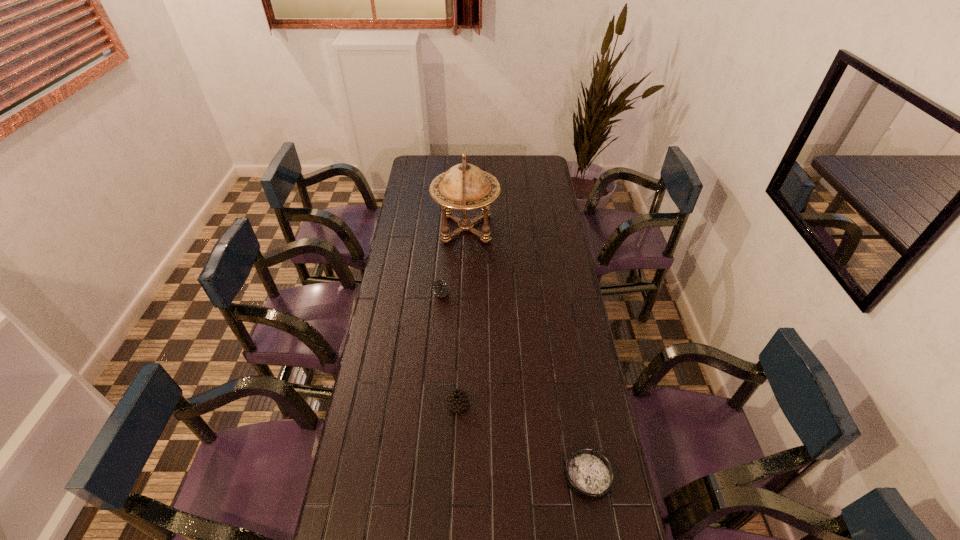
Identify the location of the farthest object. (464, 187).

At what (x,y) coordinates should I click in order to perform the action: click on globe. Please return your answer as a coordinate pair (x, y). This screenshot has width=960, height=540. Looking at the image, I should click on 464,187.

Identify the location of the second farthest object. Image resolution: width=960 pixels, height=540 pixels. (440, 286).

At what (x,y) coordinates should I click in order to perform the action: click on the left pinecone. Please return your answer as a coordinate pair (x, y). This screenshot has width=960, height=540. Looking at the image, I should click on (440, 286).

The width and height of the screenshot is (960, 540). Identify the location of the nearer pinecone. (457, 400).

The width and height of the screenshot is (960, 540). I want to click on the right pinecone, so click(457, 400).

Find the location of a particular element. Image resolution: width=960 pixels, height=540 pixels. the rightmost object is located at coordinates (589, 473).

The width and height of the screenshot is (960, 540). What are the coordinates of `ashtray` in the screenshot? It's located at (589, 473).

Where is `free spot located 0.240m on the front-facing side of the tallest object`? The width and height of the screenshot is (960, 540). free spot located 0.240m on the front-facing side of the tallest object is located at coordinates click(x=549, y=228).

Where is `vacant area located on the back of the farther pinecone`? The width and height of the screenshot is (960, 540). vacant area located on the back of the farther pinecone is located at coordinates (445, 240).